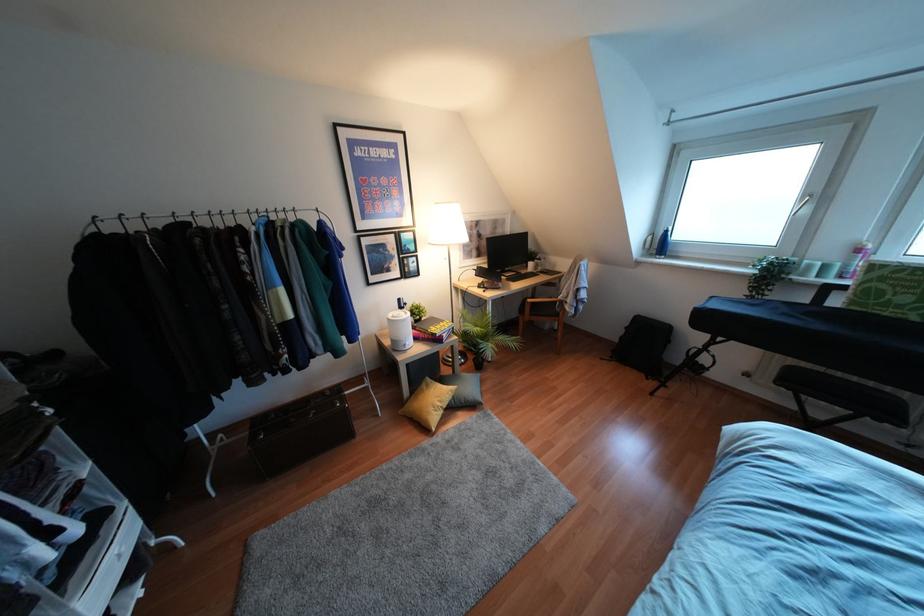
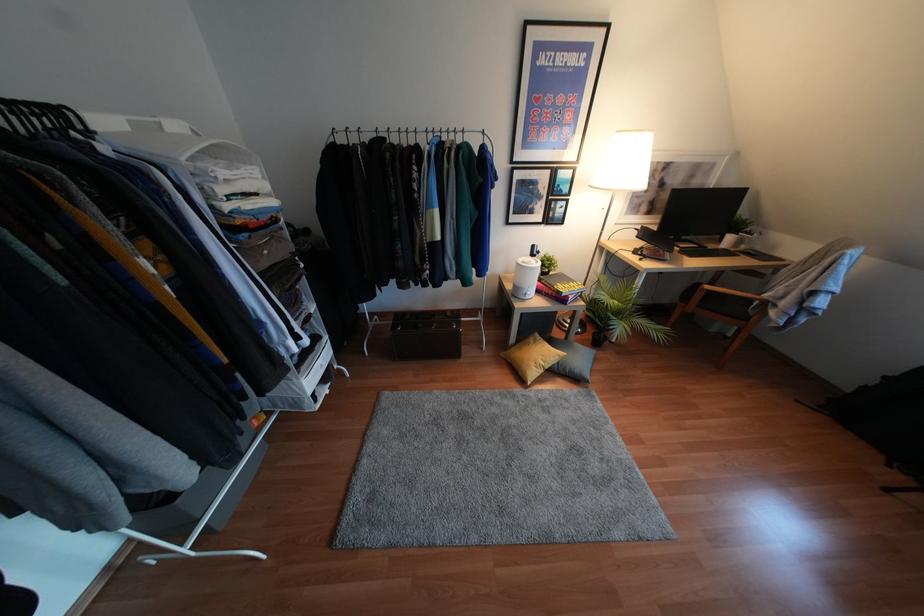
In the second image, find the point that corresponds to pixel 555 314 in the first image.

(745, 318)